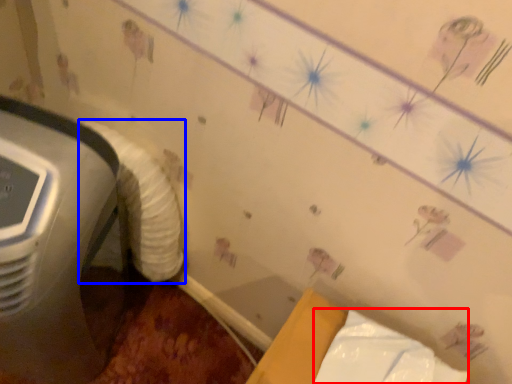
Question: Among these objects, which one is nearest to the camera, wrapping paper (highlighted by a red box) or sheet (highlighted by a blue box)?

Choices:
 (A) wrapping paper
 (B) sheet

Answer: (A)